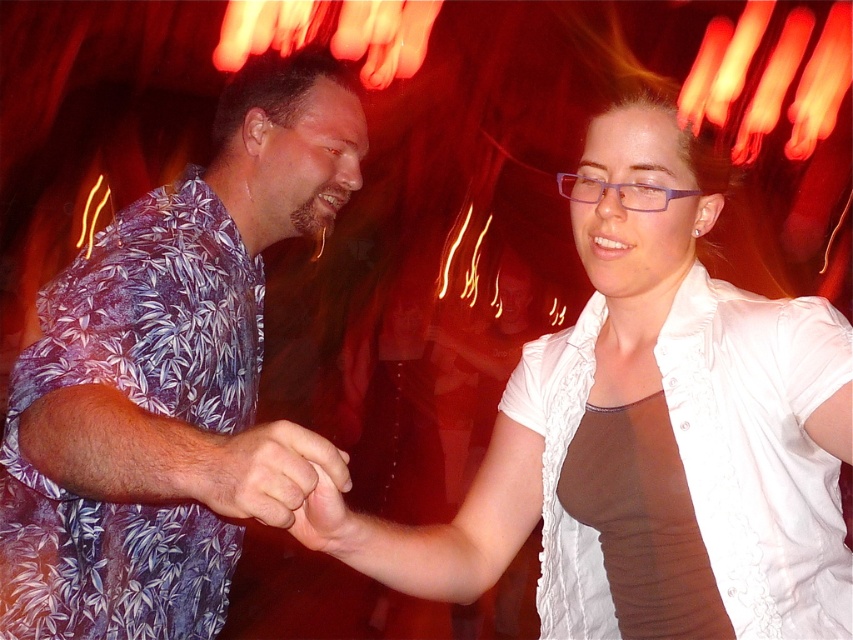
Question: Estimate the real-world distances between objects in this image. Which object is farther from the matte floral shirt at center?

Choices:
 (A) white textured blouse at center
 (B) purple leaf-patterned shirt at left

Answer: (A)

Question: Which is nearer to the matte floral shirt at center?

Choices:
 (A) purple leaf-patterned shirt at left
 (B) white textured blouse at center

Answer: (A)

Question: Does purple leaf-patterned shirt at left have a lesser width compared to matte floral shirt at center?

Choices:
 (A) no
 (B) yes

Answer: (A)

Question: Is the position of white textured blouse at center more distant than that of matte floral shirt at center?

Choices:
 (A) no
 (B) yes

Answer: (B)

Question: Can you confirm if purple leaf-patterned shirt at left is positioned to the right of white textured blouse at center?

Choices:
 (A) yes
 (B) no

Answer: (B)

Question: Which point appears farthest from the camera in this image?

Choices:
 (A) (61, 586)
 (B) (746, 632)

Answer: (A)